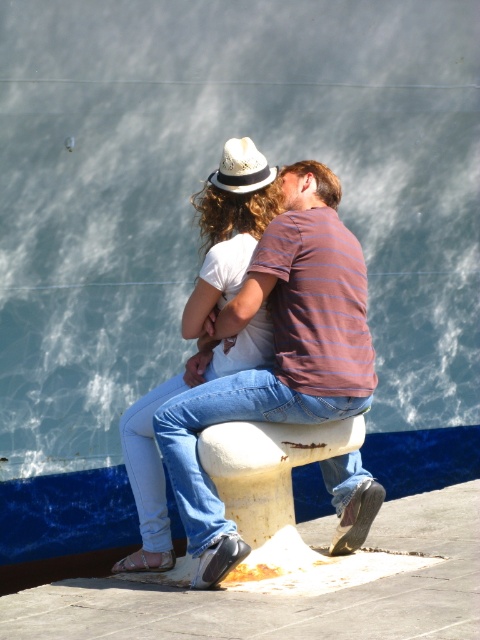
Is striped cotton shirt at center positioned behind white matte hat at upper center?

A: No, striped cotton shirt at center is in front of white matte hat at upper center.

Can you confirm if striped cotton shirt at center is bigger than white matte hat at upper center?

Indeed, striped cotton shirt at center has a larger size compared to white matte hat at upper center.

Describe the element at coordinates (277, 355) in the screenshot. I see `striped cotton shirt at center` at that location.

You are a GUI agent. You are given a task and a screenshot of the screen. Output one action in this format:
    pyautogui.click(x=<x>, y=<y>)
    Task: Click on the striped cotton shirt at center
    This screenshot has width=480, height=640.
    Given the screenshot: What is the action you would take?
    pyautogui.click(x=277, y=355)

Is white matte hat at upper center below white textured cowboy hat at center?

Correct, white matte hat at upper center is located below white textured cowboy hat at center.

Based on the photo, which of these two, white matte hat at upper center or white textured cowboy hat at center, stands shorter?

With less height is white textured cowboy hat at center.

Does point (261, 348) come closer to viewer compared to point (242, 188)?

Yes, point (261, 348) is in front of point (242, 188).

Identify the location of white matte hat at upper center. (229, 227).

Can you confirm if striped cotton shirt at center is positioned above white textured cowboy hat at center?

No, striped cotton shirt at center is not above white textured cowboy hat at center.

Does point (355, 497) lie in front of point (251, 161)?

No, (355, 497) is behind (251, 161).

Is point (283, 392) closer to viewer compared to point (269, 180)?

Yes, it is in front of point (269, 180).

Where is `striped cotton shirt at center`? This screenshot has width=480, height=640. striped cotton shirt at center is located at coordinates click(277, 355).